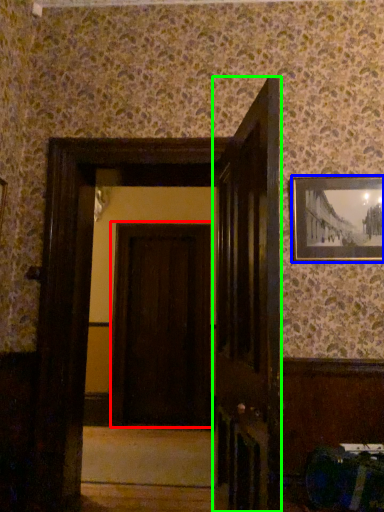
Question: Considering the real-world distances, which object is farthest from door (highlighted by a red box)? picture frame (highlighted by a blue box) or door (highlighted by a green box)?

Choices:
 (A) picture frame
 (B) door

Answer: (B)